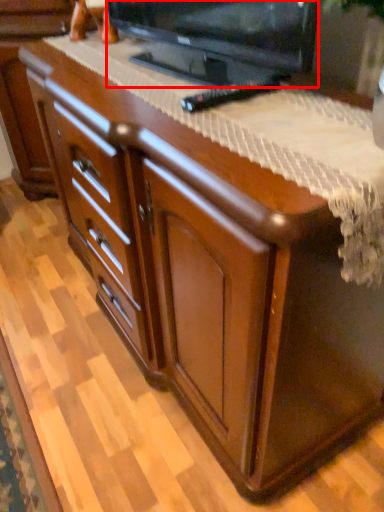
Question: From the image's perspective, where is television (annotated by the red box) located relative to remote?

Choices:
 (A) below
 (B) above

Answer: (B)